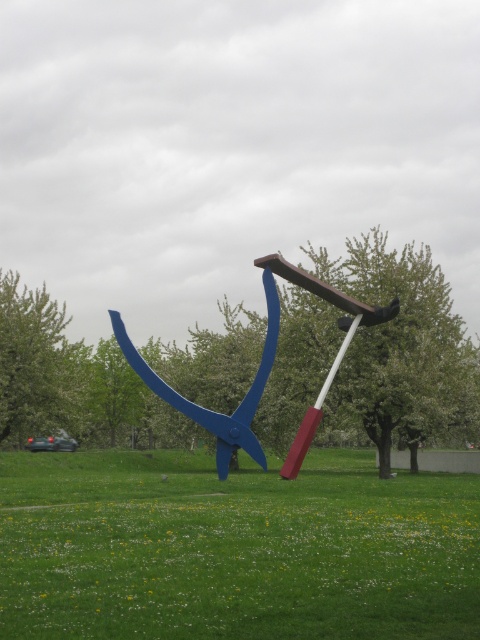
You are standing in the park and want to place a small statue exactly at the center of the green grass at center. According to the coordinates provided, what are the coordinates where you should place the statue?

The coordinates for the green grass at center are at point (x=233, y=548), so you should place the statue at those coordinates.

You are standing in the park and want to place a small yellow flower exactly at the point marked by the coordinates point (233, 548). According to the image, what object is currently occupying that location?

The green grass at center is located at point (233, 548), so placing the flower there would mean placing it on top of the green grass at center.

You are a landscape architect designing a new park. You want to place a new statue that is twice the size of the metallic blue scissor at center. Will the green grass at center have enough space to accommodate the larger statue?

The green grass at center is larger in size than the metallic blue scissor at center. If the new statue is twice the size of the metallic blue scissor at center, it would still be smaller than the green grass at center, so there should be enough space to accommodate it.